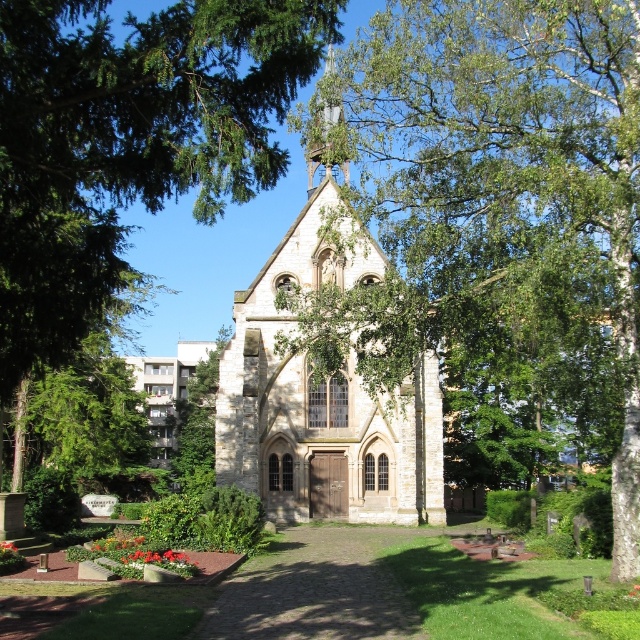
Question: Which of the following is the closest to the observer?

Choices:
 (A) green leafy tree at center
 (B) green leafy tree at upper left

Answer: (B)

Question: Is green leafy tree at upper left wider than stone church at center?

Choices:
 (A) yes
 (B) no

Answer: (A)

Question: Is green leafy tree at center behind stone church at center?

Choices:
 (A) yes
 (B) no

Answer: (B)

Question: Estimate the real-world distances between objects in this image. Which object is closer to the green leafy tree at center?

Choices:
 (A) stone church at center
 (B) green leafy tree at upper left

Answer: (A)

Question: Which of the following is the closest to the observer?

Choices:
 (A) [637, 131]
 (B) [316, 424]
 (C) [6, 145]

Answer: (C)

Question: Considering the relative positions of green leafy tree at center and stone church at center in the image provided, where is green leafy tree at center located with respect to stone church at center?

Choices:
 (A) right
 (B) left

Answer: (A)